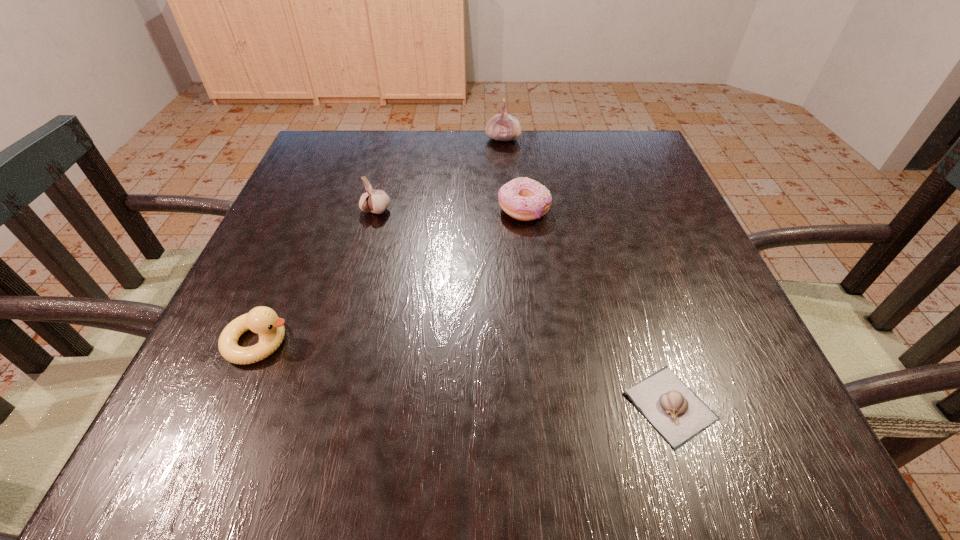
Where is `vacant space that satisfies the following two spatial constraints: 1. at the beak of the rightmost object; 2. on the right side of the duckling`? The height and width of the screenshot is (540, 960). vacant space that satisfies the following two spatial constraints: 1. at the beak of the rightmost object; 2. on the right side of the duckling is located at coordinates (232, 406).